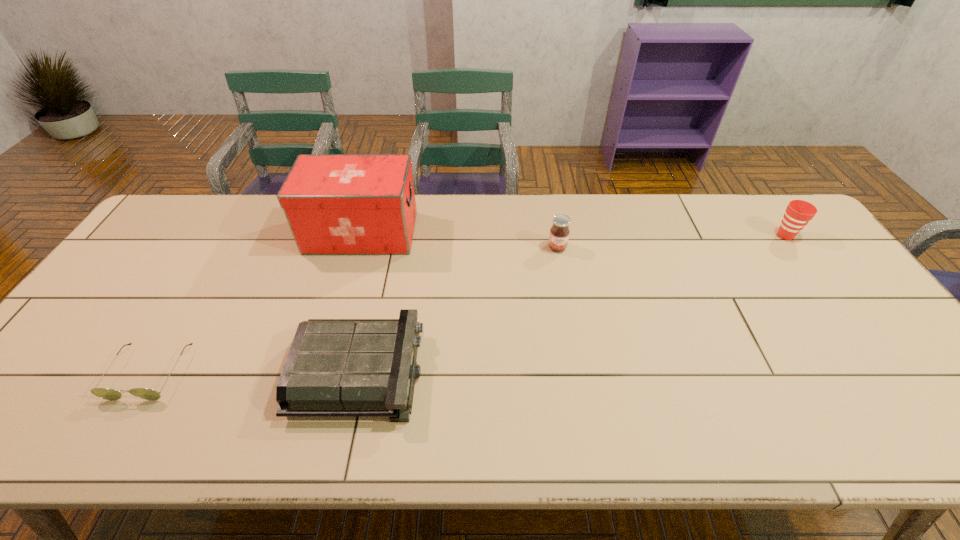
I want to click on the first-aid kit, so click(334, 203).

You are a GUI agent. You are given a task and a screenshot of the screen. Output one action in this format:
    pyautogui.click(x=<x>, y=<y>)
    Task: Click on the rightmost object
    Image resolution: width=960 pixels, height=540 pixels.
    Given the screenshot: What is the action you would take?
    pyautogui.click(x=798, y=213)

At what (x,y) coordinates should I click in order to perform the action: click on jam. Please return your answer as a coordinate pair (x, y). Looking at the image, I should click on 559,234.

I want to click on radio receiver, so click(335, 367).

Identify the location of the leftmost object. (105, 393).

Identify the location of the shortest object. The height and width of the screenshot is (540, 960). (105, 393).

Locate an element on the screen. The image size is (960, 540). free location located 0.090m on the handle side of the tallest object is located at coordinates (444, 233).

Image resolution: width=960 pixels, height=540 pixels. What are the coordinates of `free space located 0.160m on the back of the cup` in the screenshot? It's located at (757, 198).

This screenshot has width=960, height=540. I want to click on vacant space located 0.360m on the label side of the jam, so click(577, 354).

Locate an element on the screen. The width and height of the screenshot is (960, 540). free space located 0.060m on the front panel of the radio receiver is located at coordinates (447, 372).